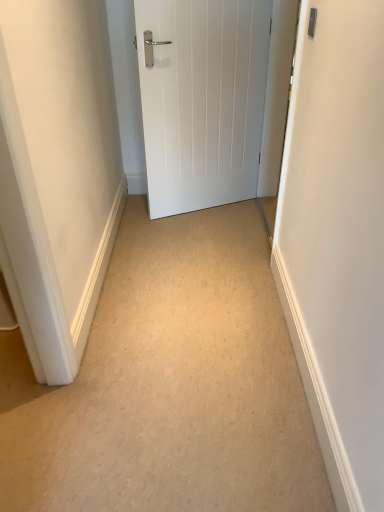
Question: Does beige carpet at center appear on the right side of white matte door at center?

Choices:
 (A) no
 (B) yes

Answer: (A)

Question: Can you confirm if beige carpet at center is thinner than white matte door at center?

Choices:
 (A) yes
 (B) no

Answer: (B)

Question: From a real-world perspective, is beige carpet at center over white matte door at center?

Choices:
 (A) yes
 (B) no

Answer: (B)

Question: Considering the relative positions of beige carpet at center and white matte door at center in the image provided, is beige carpet at center to the left of white matte door at center from the viewer's perspective?

Choices:
 (A) no
 (B) yes

Answer: (B)

Question: Can you confirm if beige carpet at center is shorter than white matte door at center?

Choices:
 (A) no
 (B) yes

Answer: (B)

Question: Would you say beige carpet at center is a long distance from white matte door at center?

Choices:
 (A) yes
 (B) no

Answer: (A)

Question: Is white matte door at center not within beige carpet at center?

Choices:
 (A) no
 (B) yes

Answer: (B)

Question: From the image's perspective, would you say white matte door at center is positioned over beige carpet at center?

Choices:
 (A) no
 (B) yes

Answer: (B)

Question: From a real-world perspective, is white matte door at center located beneath beige carpet at center?

Choices:
 (A) yes
 (B) no

Answer: (B)

Question: From a real-world perspective, is white matte door at center physically above beige carpet at center?

Choices:
 (A) yes
 (B) no

Answer: (A)

Question: Does white matte door at center appear on the left side of beige carpet at center?

Choices:
 (A) yes
 (B) no

Answer: (B)

Question: Considering the relative sizes of white matte door at center and beige carpet at center in the image provided, is white matte door at center bigger than beige carpet at center?

Choices:
 (A) no
 (B) yes

Answer: (B)

Question: Is beige carpet at center inside the boundaries of white matte door at center, or outside?

Choices:
 (A) outside
 (B) inside

Answer: (A)